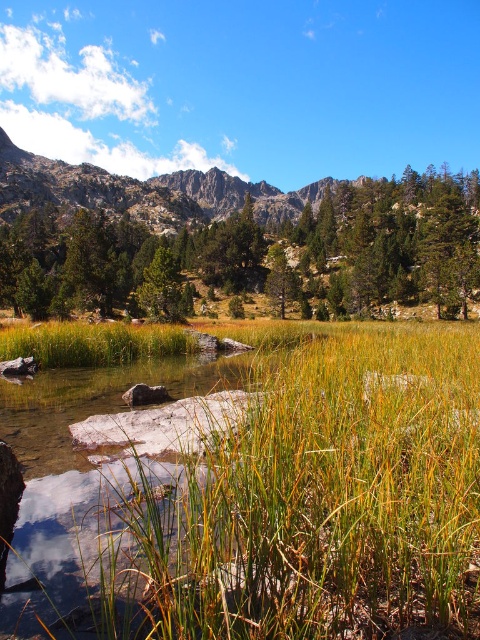
Question: Considering the real-world distances, which object is closest to the rugged granite mountain at upper left?

Choices:
 (A) green grass at center
 (B) green matte tree at upper center
 (C) green matte tree at center

Answer: (B)

Question: Does green matte tree at upper center have a greater width compared to green matte tree at center?

Choices:
 (A) yes
 (B) no

Answer: (A)

Question: Is green grass at center wider than green matte tree at upper center?

Choices:
 (A) yes
 (B) no

Answer: (B)

Question: Is the position of green grass at center more distant than that of green matte tree at center?

Choices:
 (A) no
 (B) yes

Answer: (A)

Question: Which of the following is the closest to the observer?

Choices:
 (A) green matte tree at center
 (B) green matte tree at upper center
 (C) green grass at center
 (D) rugged granite mountain at upper left

Answer: (C)

Question: Which object is closer to the camera taking this photo?

Choices:
 (A) green grass at center
 (B) green matte tree at center
 (C) rugged granite mountain at upper left

Answer: (A)